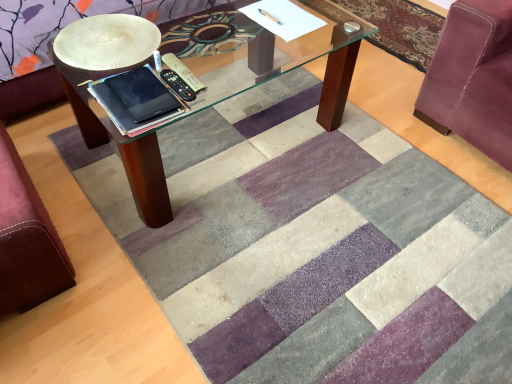
Question: Can we say velvet maroon swivel chair at right, marked as the 1th swivel chair in a right-to-left arrangement, lies outside silky purple rug at upper right?

Choices:
 (A) no
 (B) yes

Answer: (B)

Question: Can you confirm if velvet maroon swivel chair at right, placed as the 2th swivel chair when sorted from left to right, is shorter than silky purple rug at upper right?

Choices:
 (A) no
 (B) yes

Answer: (A)

Question: Does velvet maroon swivel chair at right, marked as the 1th swivel chair in a right-to-left arrangement, have a larger size compared to silky purple rug at upper right?

Choices:
 (A) no
 (B) yes

Answer: (B)

Question: Does velvet maroon swivel chair at right, placed as the 2th swivel chair when sorted from left to right, have a smaller size compared to silky purple rug at upper right?

Choices:
 (A) yes
 (B) no

Answer: (B)

Question: Does velvet maroon swivel chair at right, placed as the 2th swivel chair when sorted from left to right, lie in front of silky purple rug at upper right?

Choices:
 (A) yes
 (B) no

Answer: (A)

Question: Considering the relative positions of velvet maroon swivel chair at right, placed as the 2th swivel chair when sorted from left to right, and silky purple rug at upper right in the image provided, is velvet maroon swivel chair at right, placed as the 2th swivel chair when sorted from left to right, to the left of silky purple rug at upper right from the viewer's perspective?

Choices:
 (A) yes
 (B) no

Answer: (B)

Question: Can we say black matte tablet at center lies outside velvet maroon swivel chair at right, placed as the 2th swivel chair when sorted from left to right?

Choices:
 (A) yes
 (B) no

Answer: (A)

Question: Considering the relative sizes of black matte tablet at center and velvet maroon swivel chair at right, marked as the 1th swivel chair in a right-to-left arrangement, in the image provided, is black matte tablet at center shorter than velvet maroon swivel chair at right, marked as the 1th swivel chair in a right-to-left arrangement,?

Choices:
 (A) no
 (B) yes

Answer: (B)

Question: From the image's perspective, does black matte tablet at center appear higher than velvet maroon swivel chair at right, marked as the 1th swivel chair in a right-to-left arrangement?

Choices:
 (A) no
 (B) yes

Answer: (A)

Question: Is black matte tablet at center touching velvet maroon swivel chair at right, marked as the 1th swivel chair in a right-to-left arrangement?

Choices:
 (A) yes
 (B) no

Answer: (B)

Question: Is black matte tablet at center bigger than velvet maroon swivel chair at right, placed as the 2th swivel chair when sorted from left to right?

Choices:
 (A) yes
 (B) no

Answer: (B)

Question: Is black matte tablet at center to the left of velvet maroon swivel chair at right, marked as the 1th swivel chair in a right-to-left arrangement, from the viewer's perspective?

Choices:
 (A) no
 (B) yes

Answer: (B)

Question: From a real-world perspective, is black matte tablet at center on silky purple rug at upper right?

Choices:
 (A) no
 (B) yes

Answer: (B)